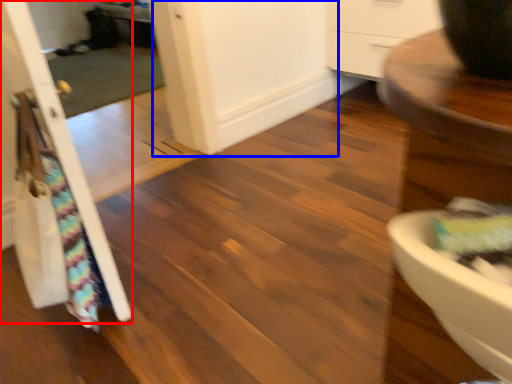
Question: Which object is closer to the camera taking this photo, door (highlighted by a red box) or screen door (highlighted by a blue box)?

Choices:
 (A) door
 (B) screen door

Answer: (A)